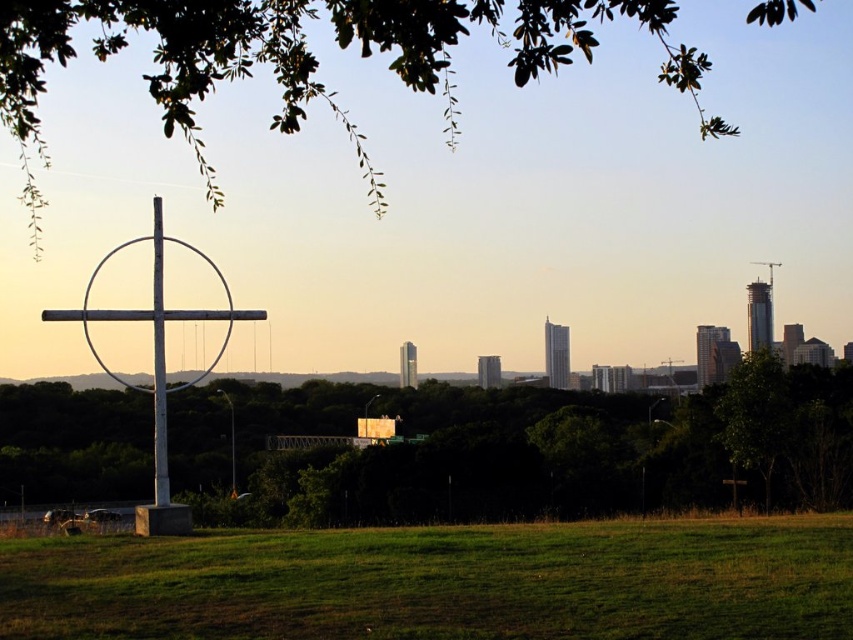
You are standing in the serene outdoor scene with golden hues. You notice two points marked in the image. Which point, point (337,564) or point (155,324), is closer to you?

Point (337,564) is closer to the viewer than point (155,324).